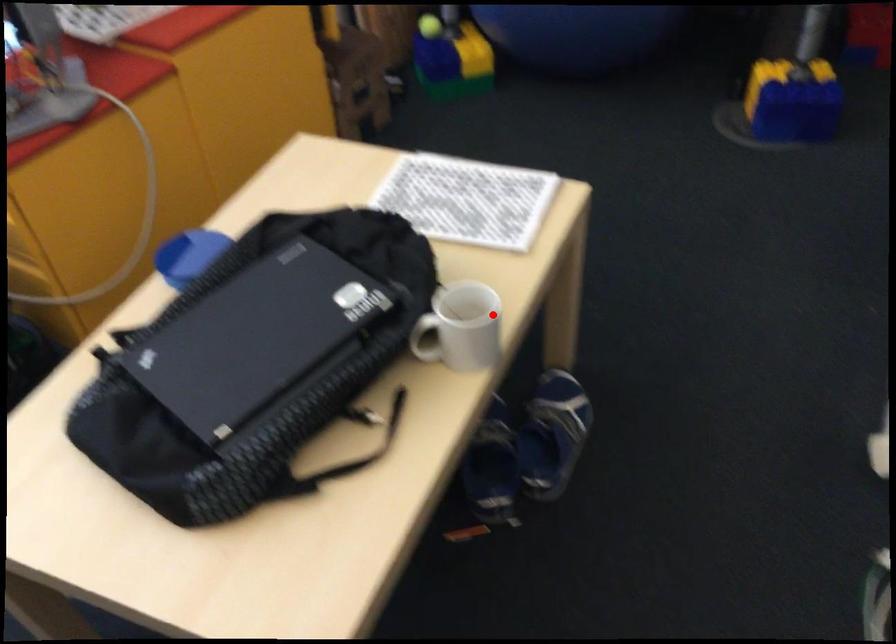
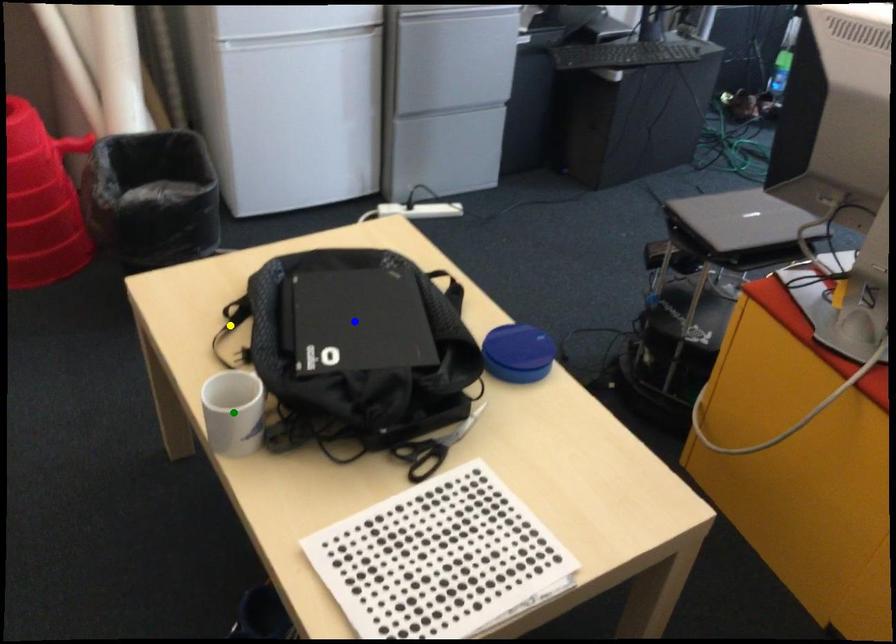
Question: I am providing you with two images of the same scene from different viewpoints. A red point is marked on the first image. You are given multiple points on the second image. Which mark in image 2 goes with the point in image 1?

Choices:
 (A) green point
 (B) yellow point
 (C) blue point

Answer: (A)